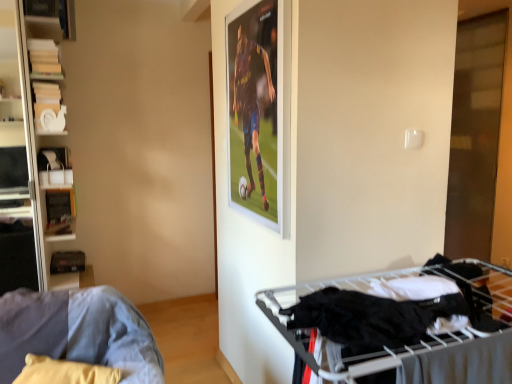
Question: From a real-world perspective, is denim fabric couch at lower left located beneath black fabric at lower right?

Choices:
 (A) no
 (B) yes

Answer: (B)

Question: Is denim fabric couch at lower left surrounding black fabric at lower right?

Choices:
 (A) no
 (B) yes

Answer: (A)

Question: Is denim fabric couch at lower left shorter than black fabric at lower right?

Choices:
 (A) no
 (B) yes

Answer: (A)

Question: From a real-world perspective, is denim fabric couch at lower left over black fabric at lower right?

Choices:
 (A) yes
 (B) no

Answer: (B)

Question: Is denim fabric couch at lower left positioned before black fabric at lower right?

Choices:
 (A) yes
 (B) no

Answer: (B)

Question: In terms of width, does denim fabric couch at lower left look wider or thinner when compared to transparent glass door at right?

Choices:
 (A) thin
 (B) wide

Answer: (B)

Question: Is denim fabric couch at lower left to the left or to the right of transparent glass door at right in the image?

Choices:
 (A) left
 (B) right

Answer: (A)

Question: Considering the positions of point (94, 289) and point (465, 86), is point (94, 289) closer or farther from the camera than point (465, 86)?

Choices:
 (A) closer
 (B) farther

Answer: (A)

Question: Is denim fabric couch at lower left bigger or smaller than transparent glass door at right?

Choices:
 (A) big
 (B) small

Answer: (B)

Question: Do you think transparent glass door at right is within white matte bookshelf at left, or outside of it?

Choices:
 (A) outside
 (B) inside

Answer: (A)

Question: In terms of width, does transparent glass door at right look wider or thinner when compared to white matte bookshelf at left?

Choices:
 (A) wide
 (B) thin

Answer: (B)

Question: Would you say transparent glass door at right is to the left or to the right of white matte bookshelf at left in the picture?

Choices:
 (A) right
 (B) left

Answer: (A)

Question: Is transparent glass door at right in front of or behind white matte bookshelf at left in the image?

Choices:
 (A) front
 (B) behind

Answer: (B)

Question: Is black fabric at lower right taller or shorter than white matte bookshelf at left?

Choices:
 (A) short
 (B) tall

Answer: (A)

Question: From the image's perspective, is black fabric at lower right located above or below white matte bookshelf at left?

Choices:
 (A) below
 (B) above

Answer: (A)